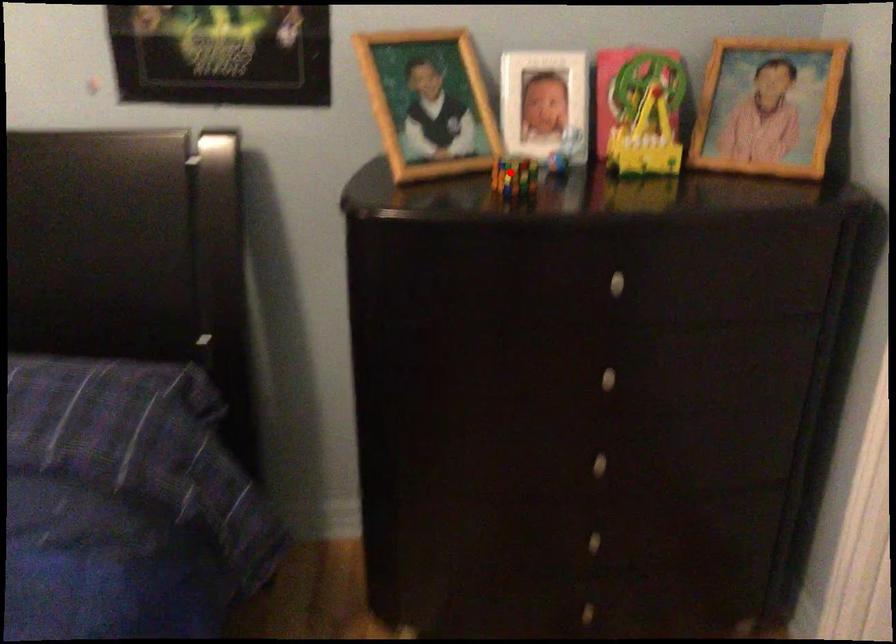
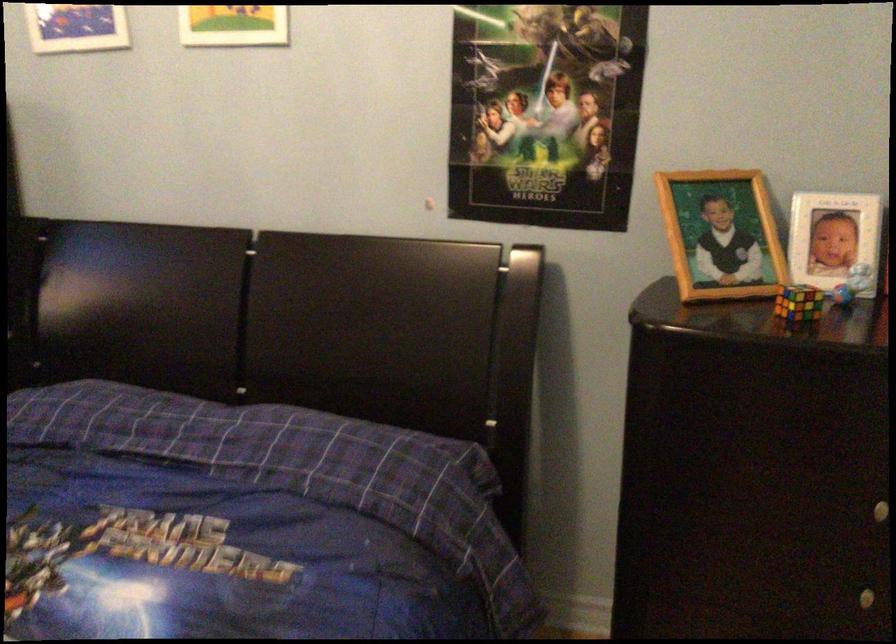
Where in the second image is the point corresponding to the highlighted location from the first image?

(798, 303)